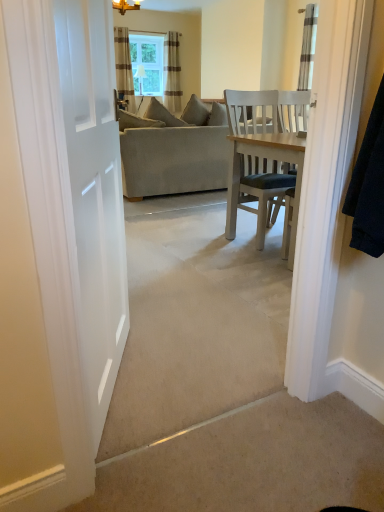
Consider the image. What is the approximate width of striped fabric curtain at upper center, which is the 2th curtain in front-to-back order?

striped fabric curtain at upper center, which is the 2th curtain in front-to-back order, is 22.77 centimeters wide.

I want to click on striped fabric curtain at upper center, which is the 3th curtain in front-to-back order, so click(172, 72).

What are the coordinates of `beige fabric couch at center` in the screenshot? It's located at (173, 160).

Image resolution: width=384 pixels, height=512 pixels. Find the location of `striped fabric curtain at upper right, which is counted as the first curtain, starting from the front`. striped fabric curtain at upper right, which is counted as the first curtain, starting from the front is located at coordinates 308,46.

Is striped fabric curtain at upper right, arranged as the third curtain when viewed from the back, smaller than striped fabric curtain at upper center, which appears as the second curtain when viewed from the left?

Indeed, striped fabric curtain at upper right, arranged as the third curtain when viewed from the back, has a smaller size compared to striped fabric curtain at upper center, which appears as the second curtain when viewed from the left.

From the image's perspective, is striped fabric curtain at upper right, which ranks as the first curtain in right-to-left order, located above striped fabric curtain at upper center, which is counted as the 2th curtain, starting from the right?

No, from the image's perspective, striped fabric curtain at upper right, which ranks as the first curtain in right-to-left order, is not on top of striped fabric curtain at upper center, which is counted as the 2th curtain, starting from the right.

Is the depth of striped fabric curtain at upper right, which ranks as the first curtain in right-to-left order, less than that of striped fabric curtain at upper center, acting as the first curtain starting from the back?

Yes, the depth of striped fabric curtain at upper right, which ranks as the first curtain in right-to-left order, is less than that of striped fabric curtain at upper center, acting as the first curtain starting from the back.

Which is more to the left, striped fabric curtain at upper right, positioned as the third curtain in left-to-right order, or striped fabric curtain at upper center, which is counted as the 2th curtain, starting from the right?

From the viewer's perspective, striped fabric curtain at upper center, which is counted as the 2th curtain, starting from the right, appears more on the left side.

Does point (143, 79) come in front of point (124, 27)?

No, (143, 79) is behind (124, 27).

Looking at their sizes, would you say clear glass window at upper center is wider or thinner than striped fabric curtain at upper center, which is the 3th curtain in right-to-left order?

Considering their sizes, clear glass window at upper center looks slimmer than striped fabric curtain at upper center, which is the 3th curtain in right-to-left order.

Is clear glass window at upper center bigger or smaller than striped fabric curtain at upper center, which is the 3th curtain in right-to-left order?

Considering their sizes, clear glass window at upper center takes up less space than striped fabric curtain at upper center, which is the 3th curtain in right-to-left order.

Is clear glass window at upper center in front of or behind striped fabric curtain at upper center, which is the 3th curtain in right-to-left order, in the image?

clear glass window at upper center is positioned farther from the viewer than striped fabric curtain at upper center, which is the 3th curtain in right-to-left order.

Between striped fabric curtain at upper center, positioned as the 1th curtain in left-to-right order, and striped fabric curtain at upper center, which is the 3th curtain in front-to-back order, which one appears on the left side from the viewer's perspective?

Positioned to the left is striped fabric curtain at upper center, positioned as the 1th curtain in left-to-right order.

From a real-world perspective, relative to striped fabric curtain at upper center, which is counted as the 2th curtain, starting from the right, is striped fabric curtain at upper center, which is the 2th curtain in front-to-back order, vertically above or below?

striped fabric curtain at upper center, which is the 2th curtain in front-to-back order, is below striped fabric curtain at upper center, which is counted as the 2th curtain, starting from the right.

Based on their sizes in the image, would you say striped fabric curtain at upper center, which is the 2th curtain in front-to-back order, is bigger or smaller than striped fabric curtain at upper center, which appears as the second curtain when viewed from the left?

Considering their sizes, striped fabric curtain at upper center, which is the 2th curtain in front-to-back order, takes up more space than striped fabric curtain at upper center, which appears as the second curtain when viewed from the left.

From the picture: Is striped fabric curtain at upper right, which ranks as the first curtain in right-to-left order, oriented away from beige fabric couch at center?

striped fabric curtain at upper right, which ranks as the first curtain in right-to-left order, is not turned away from beige fabric couch at center.

Between striped fabric curtain at upper right, arranged as the third curtain when viewed from the back, and beige fabric couch at center, which one has larger width?

Wider between the two is beige fabric couch at center.

Is striped fabric curtain at upper right, which is counted as the first curtain, starting from the front, behind beige fabric couch at center?

Yes, striped fabric curtain at upper right, which is counted as the first curtain, starting from the front, is behind beige fabric couch at center.

The height and width of the screenshot is (512, 384). In order to click on studio couch located on the left of striped fabric curtain at upper right, positioned as the third curtain in left-to-right order in this screenshot , I will do [x=173, y=160].

From the picture: In terms of size, does clear glass window at upper center appear bigger or smaller than striped fabric curtain at upper center, which is the 3th curtain in front-to-back order?

clear glass window at upper center is smaller than striped fabric curtain at upper center, which is the 3th curtain in front-to-back order.

From a real-world perspective, does clear glass window at upper center sit lower than striped fabric curtain at upper center, which appears as the second curtain when viewed from the left?

Incorrect, from a real-world perspective, clear glass window at upper center is higher than striped fabric curtain at upper center, which appears as the second curtain when viewed from the left.

Considering the positions of point (147, 60) and point (175, 102), is point (147, 60) closer or farther from the camera than point (175, 102)?

Clearly, point (147, 60) is more distant from the camera than point (175, 102).

How different are the orientations of clear glass window at upper center and striped fabric curtain at upper center, which is the 3th curtain in front-to-back order, in degrees?

0.00397 degrees separate the facing orientations of clear glass window at upper center and striped fabric curtain at upper center, which is the 3th curtain in front-to-back order.

Is clear glass window at upper center behind striped fabric curtain at upper right, positioned as the third curtain in left-to-right order?

Yes.

Is clear glass window at upper center inside or outside of striped fabric curtain at upper right, which is counted as the first curtain, starting from the front?

clear glass window at upper center is spatially situated outside striped fabric curtain at upper right, which is counted as the first curtain, starting from the front.

Which of these two, clear glass window at upper center or striped fabric curtain at upper right, arranged as the third curtain when viewed from the back, is bigger?

clear glass window at upper center is bigger.

In the scene shown: Could you measure the distance between clear glass window at upper center and striped fabric curtain at upper right, which ranks as the first curtain in right-to-left order?

9.37 feet.

Does point (123, 77) appear closer or farther from the camera than point (186, 137)?

Clearly, point (123, 77) is more distant from the camera than point (186, 137).

Is striped fabric curtain at upper center, which is the 3th curtain in right-to-left order, beside beige fabric couch at center?

No, striped fabric curtain at upper center, which is the 3th curtain in right-to-left order, is not beside beige fabric couch at center.

Considering the sizes of striped fabric curtain at upper center, positioned as the 1th curtain in left-to-right order, and beige fabric couch at center in the image, is striped fabric curtain at upper center, positioned as the 1th curtain in left-to-right order, wider or thinner than beige fabric couch at center?

Clearly, striped fabric curtain at upper center, positioned as the 1th curtain in left-to-right order, has less width compared to beige fabric couch at center.

From the image's perspective, is striped fabric curtain at upper center, which is the 3th curtain in right-to-left order, beneath beige fabric couch at center?

No, from the image's perspective, striped fabric curtain at upper center, which is the 3th curtain in right-to-left order, is not beneath beige fabric couch at center.

Locate an element on the screen. The height and width of the screenshot is (512, 384). curtain that is the 2nd one when counting backward from the striped fabric curtain at upper right, which ranks as the first curtain in right-to-left order is located at coordinates (172, 72).

The width and height of the screenshot is (384, 512). What are the coordinates of `curtain that is the 2nd one when counting downward from the clear glass window at upper center (from the image's perspective)` in the screenshot? It's located at (124, 67).

Based on their spatial positions, is striped fabric curtain at upper center, which is the 3th curtain in front-to-back order, or clear glass window at upper center further from striped fabric curtain at upper center, which is the 2th curtain in front-to-back order?

striped fabric curtain at upper center, which is the 3th curtain in front-to-back order, is further to striped fabric curtain at upper center, which is the 2th curtain in front-to-back order.

Based on their spatial positions, is striped fabric curtain at upper right, arranged as the third curtain when viewed from the back, or clear glass window at upper center further from beige fabric couch at center?

Based on the image, clear glass window at upper center appears to be further to beige fabric couch at center.

When comparing their distances from striped fabric curtain at upper right, arranged as the third curtain when viewed from the back, does beige fabric couch at center or clear glass window at upper center seem further?

Based on the image, clear glass window at upper center appears to be further to striped fabric curtain at upper right, arranged as the third curtain when viewed from the back.

Based on their spatial positions, is striped fabric curtain at upper center, which appears as the second curtain when viewed from the left, or beige fabric couch at center further from striped fabric curtain at upper right, which ranks as the first curtain in right-to-left order?

Based on the image, striped fabric curtain at upper center, which appears as the second curtain when viewed from the left, appears to be further to striped fabric curtain at upper right, which ranks as the first curtain in right-to-left order.

Which object lies nearer to the anchor point beige fabric couch at center, clear glass window at upper center or striped fabric curtain at upper center, which is the 3th curtain in front-to-back order?

Among the two, striped fabric curtain at upper center, which is the 3th curtain in front-to-back order, is located nearer to beige fabric couch at center.

When comparing their distances from clear glass window at upper center, does striped fabric curtain at upper right, which ranks as the first curtain in right-to-left order, or beige fabric couch at center seem further?

beige fabric couch at center lies further to clear glass window at upper center than the other object.

Looking at the image, which one is located further to beige fabric couch at center, striped fabric curtain at upper center, which is counted as the 2th curtain, starting from the right, or striped fabric curtain at upper center, which is the 2th curtain in front-to-back order?

Among the two, striped fabric curtain at upper center, which is counted as the 2th curtain, starting from the right, is located further to beige fabric couch at center.

Considering their positions, is striped fabric curtain at upper center, which is counted as the 2th curtain, starting from the back, positioned closer to beige fabric couch at center than clear glass window at upper center?

striped fabric curtain at upper center, which is counted as the 2th curtain, starting from the back.

The image size is (384, 512). Identify the location of curtain positioned between beige fabric couch at center and striped fabric curtain at upper center, which is the 3th curtain in right-to-left order, from near to far. (308, 46).

In order to click on window between striped fabric curtain at upper center, which is the 3th curtain in right-to-left order, and striped fabric curtain at upper right, which is counted as the first curtain, starting from the front in this screenshot , I will do `click(147, 63)`.

Locate an element on the screen. The width and height of the screenshot is (384, 512). curtain situated between striped fabric curtain at upper center, positioned as the 1th curtain in left-to-right order, and striped fabric curtain at upper right, which is counted as the first curtain, starting from the front, from left to right is located at coordinates (172, 72).

Locate an element on the screen. window between striped fabric curtain at upper center, which is the 3th curtain in right-to-left order, and striped fabric curtain at upper center, which is the 3th curtain in front-to-back order is located at coordinates (147, 63).